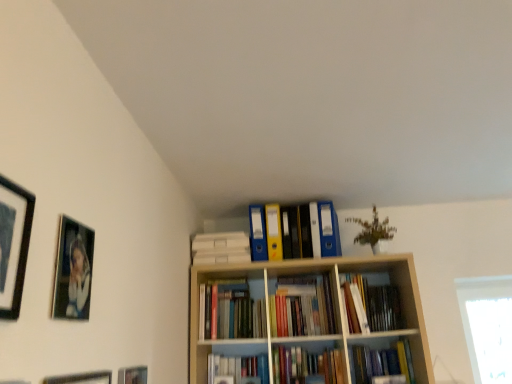
Question: Is hardcover books at center, arranged as the second book when viewed from the top, inside the boundaries of matte plastic folders at upper center, the first book positioned from the top, or outside?

Choices:
 (A) inside
 (B) outside

Answer: (B)

Question: From their relative heights in the image, would you say hardcover books at center, arranged as the second book when viewed from the top, is taller or shorter than matte plastic folders at upper center, the first book positioned from the top?

Choices:
 (A) tall
 (B) short

Answer: (B)

Question: Considering the real-world distances, which object is farthest from the matte black picture frame at lower left, which is the 2th picture frame in bottom-to-top order?

Choices:
 (A) hardcover books at center, which is the 2th book from bottom to top
 (B) hardcover book at center, which appears as the 3th book when viewed from the top
 (C) matte black picture frame at lower left, which is counted as the fourth picture frame, starting from the top
 (D) matte plastic folders at upper center, which is counted as the 3th book, starting from the bottom
 (E) matte black picture frame at upper left, the 4th picture frame when ordered from bottom to top

Answer: (B)

Question: Based on their relative distances, which object is nearer to the hardcover books at center, arranged as the second book when viewed from the top?

Choices:
 (A) metallic silver picture frame at upper left, acting as the third picture frame starting from the bottom
 (B) hardcover book at center, which appears as the 3th book when viewed from the top
 (C) matte black picture frame at lower left, which is counted as the 1th picture frame, starting from the bottom
 (D) matte plastic folders at upper center, which is counted as the 3th book, starting from the bottom
 (E) matte black picture frame at upper left, positioned as the 1th picture frame in top-to-bottom order

Answer: (B)